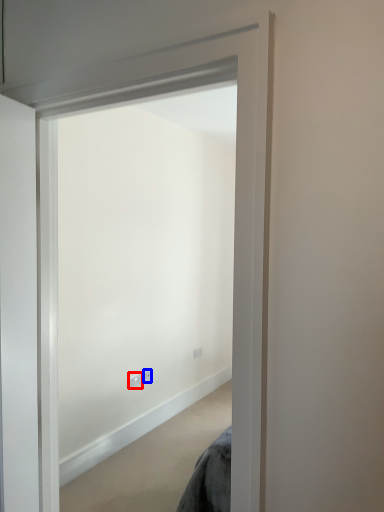
Question: Which object appears farthest to the camera in this image, electric outlet (highlighted by a red box) or electric outlet (highlighted by a blue box)?

Choices:
 (A) electric outlet
 (B) electric outlet

Answer: (B)